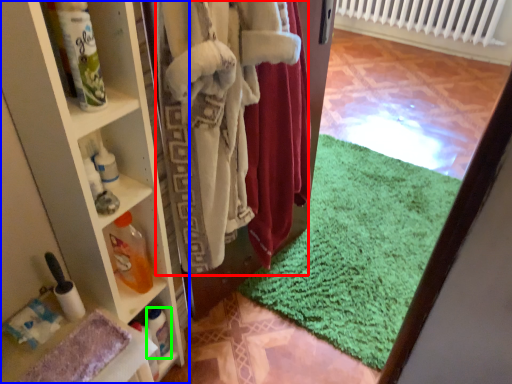
Question: Based on their relative distances, which object is nearer to clothing (highlighted by a red box)? Choose from shelf (highlighted by a blue box) and bottle (highlighted by a green box).

Choices:
 (A) shelf
 (B) bottle

Answer: (A)